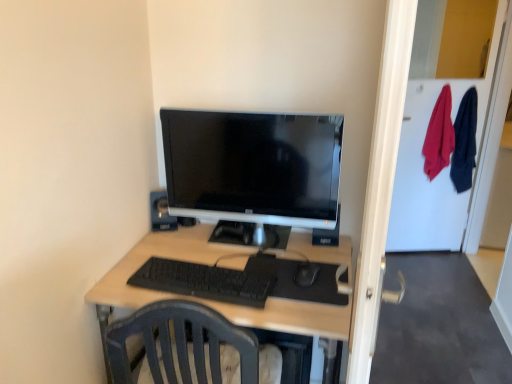
At what (x,y) coordinates should I click in order to perform the action: click on unoccupied space behind black plastic mouse at center. Please return your answer as a coordinate pair (x, y). The height and width of the screenshot is (384, 512). Looking at the image, I should click on (300, 252).